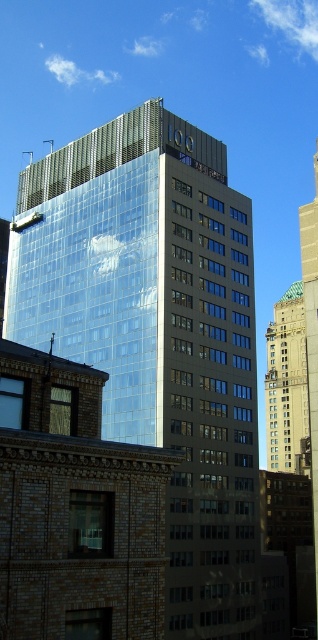
Consider the image. What are the coordinates of the glassy reflective building at center in the image?

The glassy reflective building at center is located at coordinates point (157, 332).

You are a drone operator tasked with flying a drone between the glassy reflective building at center and the gold metallic bell tower at upper right. The drone has a maximum flight distance of 100 meters. Can the drone safely fly between these two structures without exceeding its range?

The glassy reflective building at center and gold metallic bell tower at upper right are 91.79 meters apart from each other. Since the drone has a maximum flight distance of 100 meters, it can safely fly between them as the distance is within its range.

You are an architect analyzing the building layout. From your vantage point, which object is positioned closer to you between the glassy reflective building at center and the gold metallic bell tower at upper right?

The glassy reflective building at center is closer to the viewer than the gold metallic bell tower at upper right.